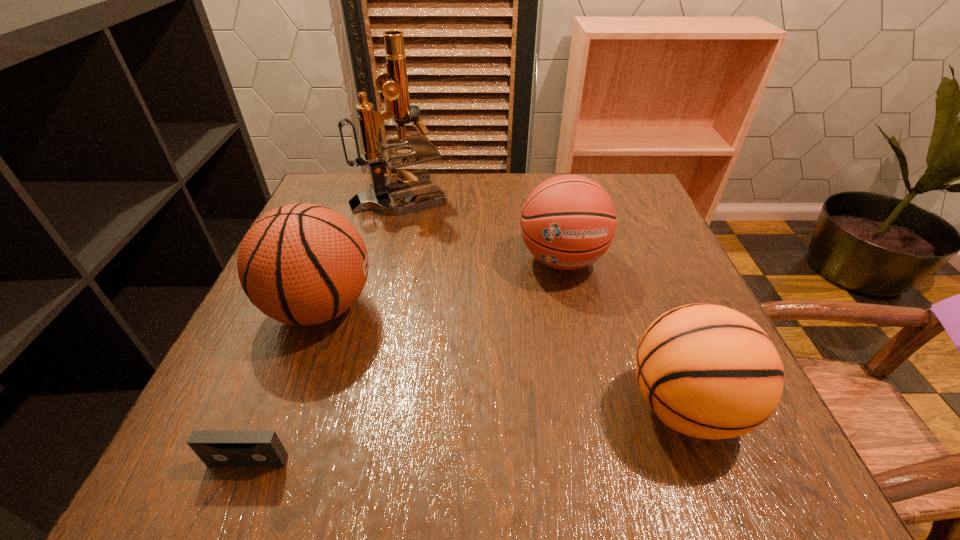
Identify the location of videotape that is at the near edge. (215, 448).

The image size is (960, 540). I want to click on microscope at the left edge, so click(394, 84).

This screenshot has width=960, height=540. I want to click on basketball that is at the left edge, so click(304, 264).

This screenshot has height=540, width=960. Identify the location of videotape present at the left edge. click(215, 448).

Locate an element on the screen. object positioned at the far left corner is located at coordinates (394, 84).

At what (x,y) coordinates should I click in order to perform the action: click on object at the near left corner. Please return your answer as a coordinate pair (x, y). Looking at the image, I should click on (215, 448).

Where is `object that is at the near right corner`? object that is at the near right corner is located at coordinates (708, 371).

In the image, there is a desktop. Identify the location of vacant space at the far edge. Image resolution: width=960 pixels, height=540 pixels. (511, 213).

In the image, there is a desktop. Identify the location of free region at the near edge. Image resolution: width=960 pixels, height=540 pixels. (467, 426).

Image resolution: width=960 pixels, height=540 pixels. Find the location of `vacant region at the left edge`. vacant region at the left edge is located at coordinates (254, 412).